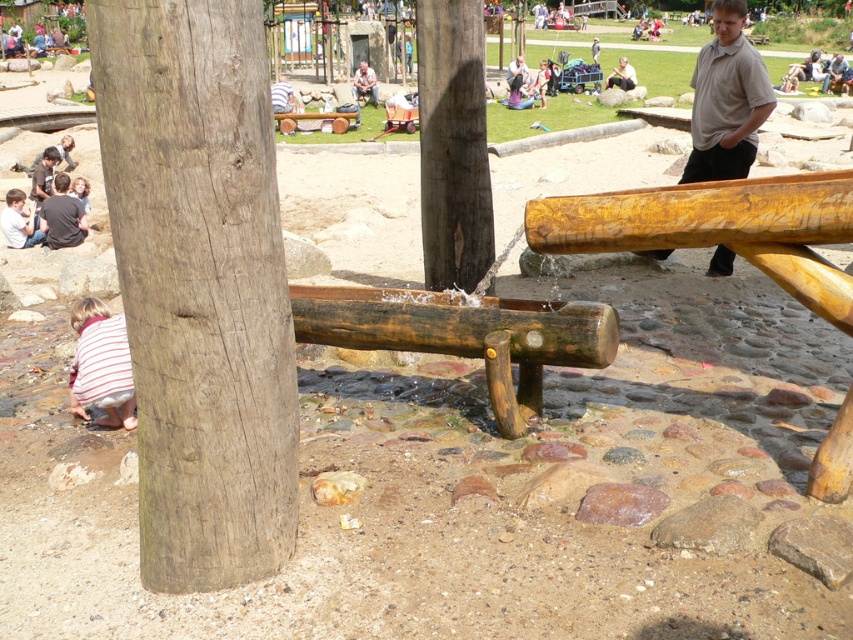
Is light brown wooden bench at right wider than striped shirt at lower left?

Indeed, light brown wooden bench at right has a greater width compared to striped shirt at lower left.

Image resolution: width=853 pixels, height=640 pixels. Describe the element at coordinates (726, 99) in the screenshot. I see `light brown wooden bench at right` at that location.

Is point (717, 8) positioned before point (131, 403)?

No.

What are the coordinates of `light brown wooden bench at right` in the screenshot? It's located at (x=726, y=99).

Which is in front, point (15, 220) or point (50, 147)?

Positioned in front is point (15, 220).

Can you confirm if matte brown shirt at lower left is positioned to the right of brown leather jacket at lower left?

Correct, you'll find matte brown shirt at lower left to the right of brown leather jacket at lower left.

Is point (20, 198) closer to camera compared to point (32, 189)?

Yes, point (20, 198) is in front of point (32, 189).

This screenshot has height=640, width=853. Find the location of `matte brown shirt at lower left`. matte brown shirt at lower left is located at coordinates (19, 221).

Between wooden bench at center and weathered wood pole at center, which one has less height?

wooden bench at center

The image size is (853, 640). What do you see at coordinates (718, 227) in the screenshot?
I see `wooden bench at center` at bounding box center [718, 227].

Measure the distance between wooden bench at center and camera.

wooden bench at center and camera are 3.33 meters apart from each other.

I want to click on wooden bench at center, so click(718, 227).